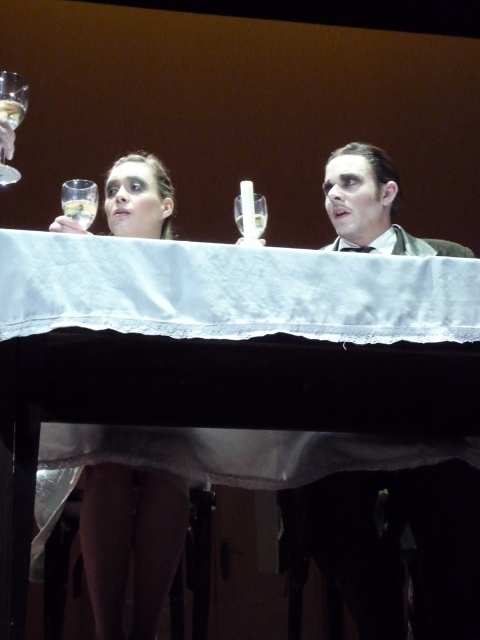
Can you confirm if clear glass wine glass at left is positioned above clear glass wine glass at center?

Incorrect, clear glass wine glass at left is not positioned above clear glass wine glass at center.

Between clear glass wine glass at left and clear glass wine glass at center, which one appears on the left side from the viewer's perspective?

clear glass wine glass at left

Who is more distant from viewer, (x=74, y=212) or (x=242, y=234)?

The point (x=242, y=234) is behind.

Image resolution: width=480 pixels, height=640 pixels. Identify the location of clear glass wine glass at left. (80, 200).

Can you confirm if white cloth-covered table at center is bigger than clear glass wine glass at left?

Correct, white cloth-covered table at center is larger in size than clear glass wine glass at left.

Does point (183, 326) come behind point (69, 216)?

No, (183, 326) is closer to viewer.

The image size is (480, 640). I want to click on white cloth-covered table at center, so click(230, 291).

Between white cloth-covered table at center and clear glass wine glass at upper left, which one appears on the right side from the viewer's perspective?

From the viewer's perspective, white cloth-covered table at center appears more on the right side.

Is white cloth-covered table at center smaller than clear glass wine glass at upper left?

No.

Is point (268, 326) positioned before point (25, 97)?

That is True.

Identify the location of white cloth-covered table at center. (230, 291).